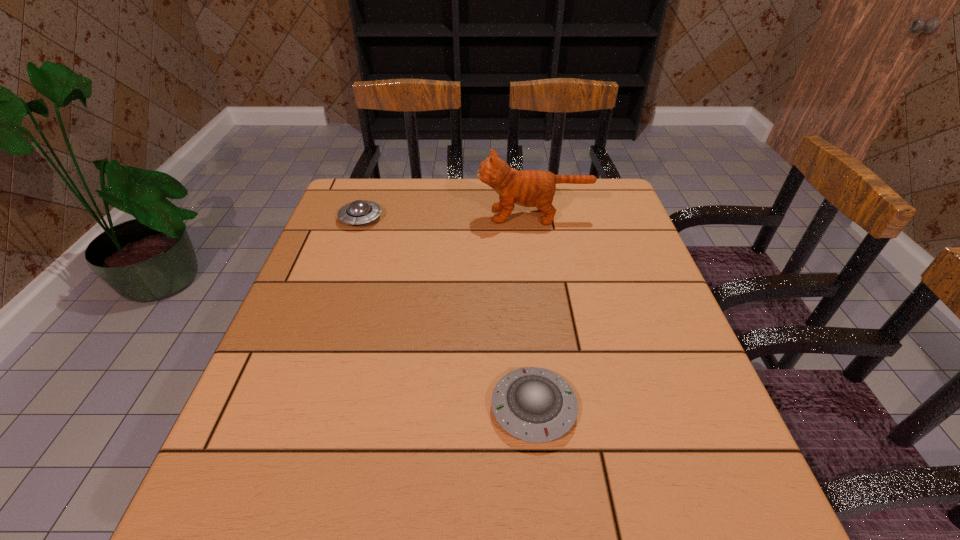
Where is `blank region between the nearer saucer and the farther saucer`? The width and height of the screenshot is (960, 540). blank region between the nearer saucer and the farther saucer is located at coordinates (447, 313).

Where is `free space between the cat and the nearest object`? The width and height of the screenshot is (960, 540). free space between the cat and the nearest object is located at coordinates (534, 312).

Where is `free spot between the cat and the nearest object`? free spot between the cat and the nearest object is located at coordinates (534, 312).

The height and width of the screenshot is (540, 960). Find the location of `object that is the second closest to the shorter saucer`. object that is the second closest to the shorter saucer is located at coordinates (357, 212).

Locate an element on the screen. the closest object to the cat is located at coordinates (357, 212).

Where is `vacant area that satisfies the following two spatial constraints: 1. on the face of the tallest object; 2. on the front side of the right saucer`? vacant area that satisfies the following two spatial constraints: 1. on the face of the tallest object; 2. on the front side of the right saucer is located at coordinates (564, 408).

This screenshot has width=960, height=540. I want to click on free space that satisfies the following two spatial constraints: 1. on the face of the cat; 2. on the front side of the left saucer, so click(534, 218).

You are a GUI agent. You are given a task and a screenshot of the screen. Output one action in this format:
    pyautogui.click(x=<x>, y=<y>)
    Task: Click on the blank area in the image that satisfies the following two spatial constraints: 1. on the face of the tallest object; 2. on the front side of the shortest object
    The height and width of the screenshot is (540, 960).
    Given the screenshot: What is the action you would take?
    pyautogui.click(x=564, y=408)